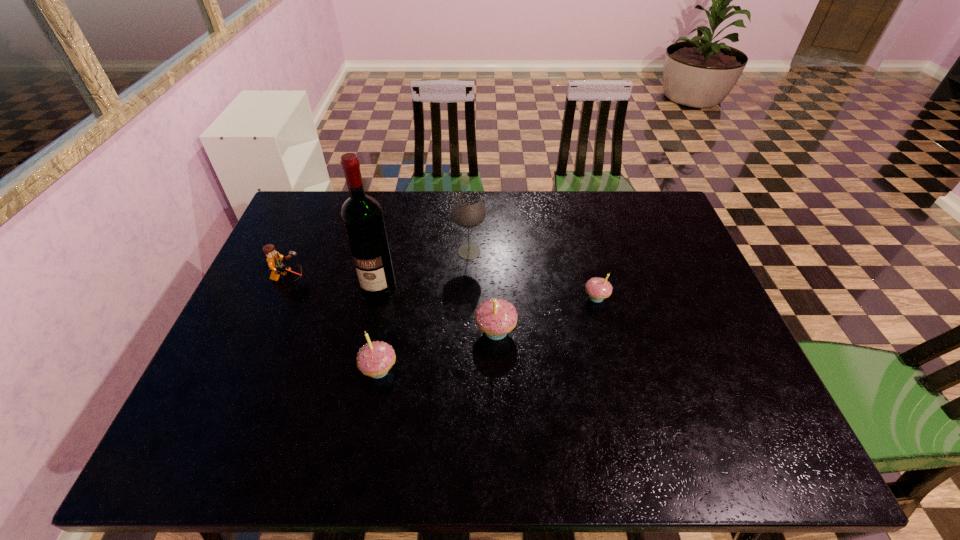
Where is `free space at the left edge`? The height and width of the screenshot is (540, 960). free space at the left edge is located at coordinates (232, 334).

You are a GUI agent. You are given a task and a screenshot of the screen. Output one action in this format:
    pyautogui.click(x=<x>, y=<y>)
    Task: Click on the vacant area at the right edge of the desktop
    
    Given the screenshot: What is the action you would take?
    pyautogui.click(x=668, y=271)

Where is `vacant region at the far left corner of the desktop`? vacant region at the far left corner of the desktop is located at coordinates (283, 233).

This screenshot has height=540, width=960. I want to click on free space at the near right corner, so click(x=758, y=414).

Locate an element on the screen. free space between the third tallest object and the second tallest cupcake is located at coordinates (438, 350).

The width and height of the screenshot is (960, 540). What are the coordinates of `free space between the alcohol and the leftmost object` in the screenshot? It's located at (334, 283).

Identify the location of unoccupied position between the nearest cupcake and the second cupcake from left to right. The image size is (960, 540). (438, 350).

Image resolution: width=960 pixels, height=540 pixels. In order to click on vacant space that's between the rightmost object and the leftmost object in this screenshot , I will do `click(443, 288)`.

You are a GUI agent. You are given a task and a screenshot of the screen. Output one action in this format:
    pyautogui.click(x=<x>, y=<y>)
    Task: Click on the vacant point located between the farthest object and the fifth farthest object
    This screenshot has width=960, height=540.
    Given the screenshot: What is the action you would take?
    pyautogui.click(x=482, y=292)

Image resolution: width=960 pixels, height=540 pixels. Identify the location of vacant space that's between the wineglass and the fourth shortest object. (482, 292).